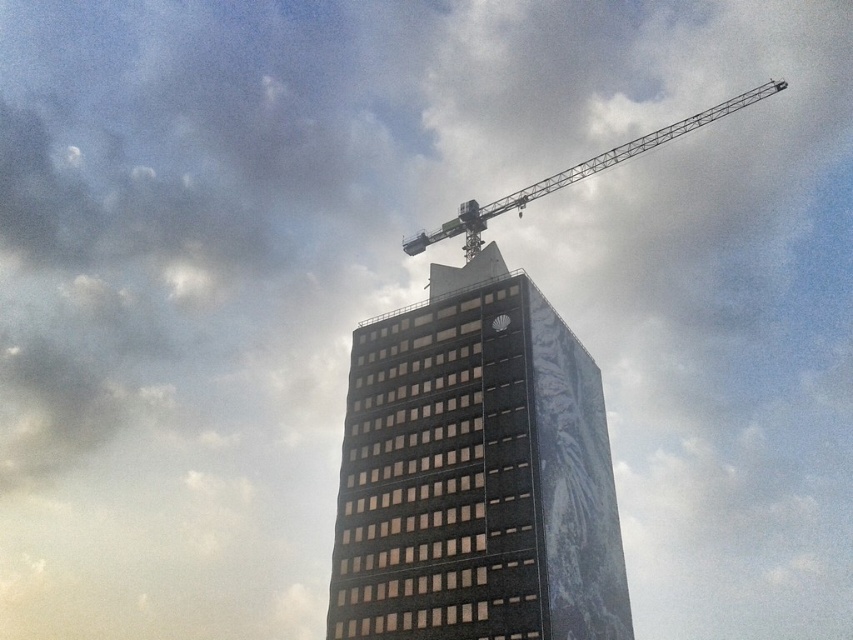
Question: Is black glass building at center bigger than metallic gray crane at upper right?

Choices:
 (A) yes
 (B) no

Answer: (B)

Question: Which of the following is the farthest from the observer?

Choices:
 (A) (593, 416)
 (B) (604, 168)

Answer: (B)

Question: Does black glass building at center come in front of metallic gray crane at upper right?

Choices:
 (A) no
 (B) yes

Answer: (B)

Question: Can you confirm if black glass building at center is positioned above metallic gray crane at upper right?

Choices:
 (A) no
 (B) yes

Answer: (A)

Question: Which point is farther to the camera?

Choices:
 (A) (500, 202)
 (B) (366, 637)

Answer: (A)